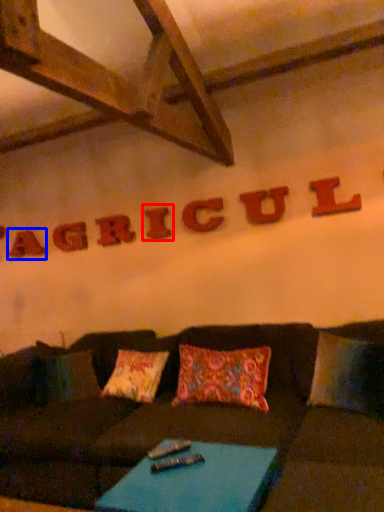
Question: Among these objects, which one is farthest to the camera, letter (highlighted by a red box) or letter (highlighted by a blue box)?

Choices:
 (A) letter
 (B) letter

Answer: (B)